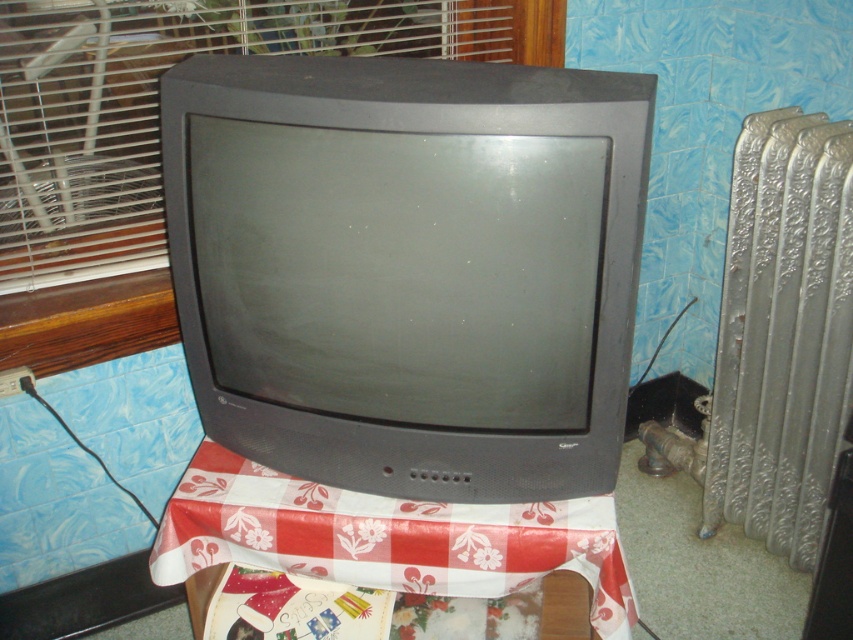
You are moving a large box that is 1 meter wide. You need to place it on the table between the silver textured radiator at right and the plastic wrapping paper at center. Is there enough space for the box?

The silver textured radiator at right has a lesser width compared to plastic wrapping paper at center. Therefore, the space between them may not be sufficient for a box that is 1 meter wide. Check the actual distance before placing the box.

You are standing in front of the table with the vintage CRT television. There is a point marked at coordinates (x=782, y=336). What object is located at that point?

The point at coordinates (x=782, y=336) marks the silver textured radiator at right.